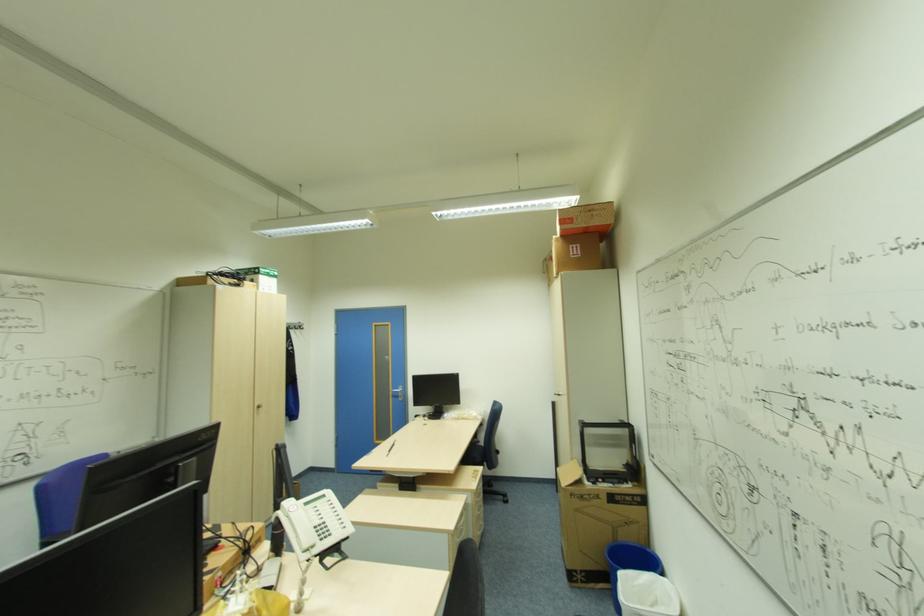
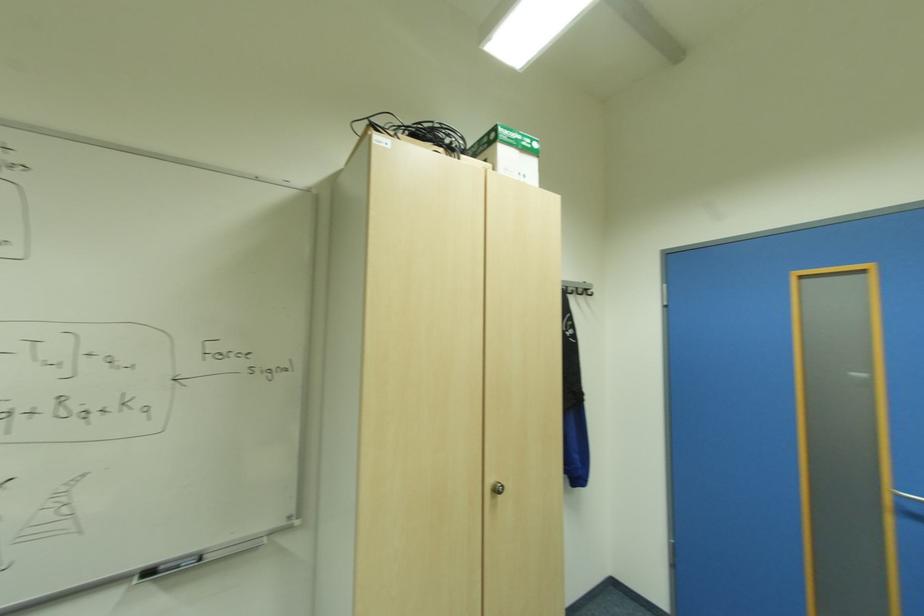
In the second image, find the point that corresponds to point 302,325 in the first image.

(588, 291)